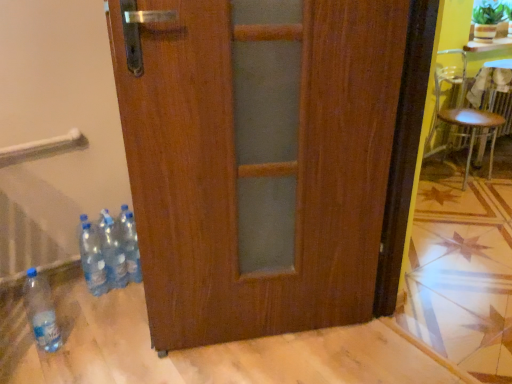
Where is `vacant area in front of translucent plastic bottles at lower left, the second bottle when ordered from right to left`? vacant area in front of translucent plastic bottles at lower left, the second bottle when ordered from right to left is located at coordinates (104, 309).